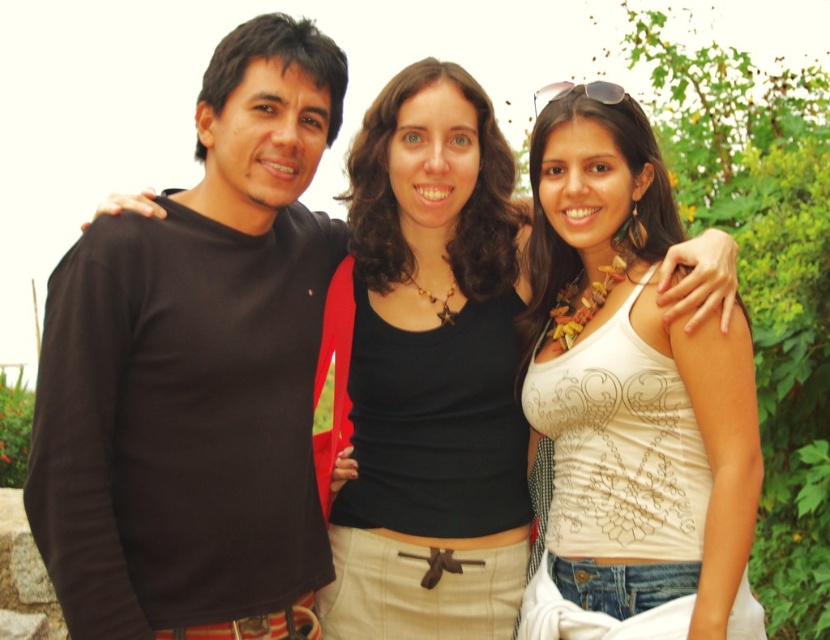
You are trying to decide which clothing item to purchase between the black matte shirt at left and the black matte tank top at center. Based on the image, which one is positioned lower on the person?

The black matte shirt at left is positioned lower on the person because it is below the black matte tank top at center.

You are a photographer trying to adjust the camera focus. The black matte shirt at left and the black matte tank top at center are both in the frame. Which one should you focus on first if you want to ensure the taller subject is sharp?

The black matte shirt at left is much taller than the black matte tank top at center, so you should focus on the black matte shirt at left first to ensure the taller subject is sharp.